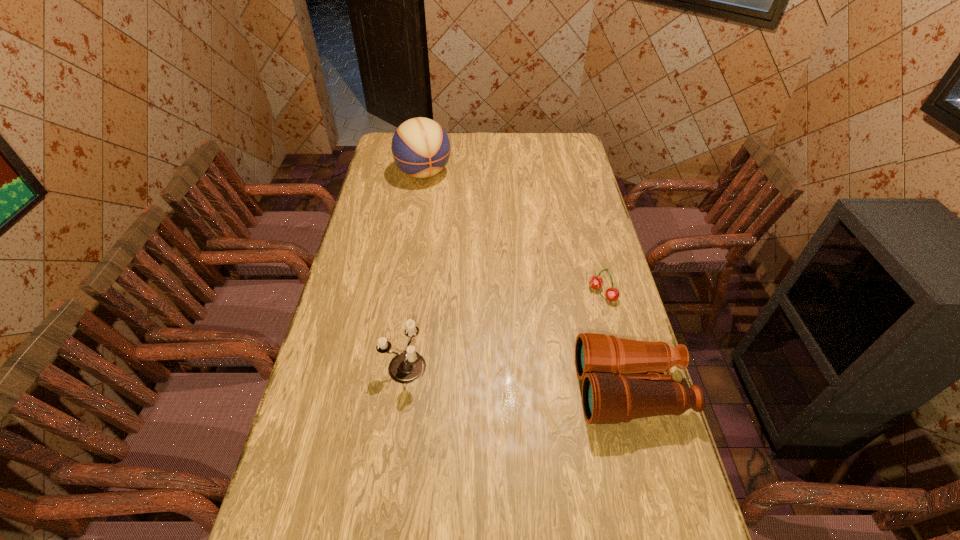
This screenshot has width=960, height=540. In order to click on free space that satisfies the following two spatial constraints: 1. on the front side of the binoculars; 2. through the lenses of the candle holder in this screenshot , I will do `click(401, 390)`.

The image size is (960, 540). What are the coordinates of `blank area in the image that satisfies the following two spatial constraints: 1. on the back side of the candle holder; 2. on the right side of the cherry` in the screenshot? It's located at (415, 293).

The height and width of the screenshot is (540, 960). What are the coordinates of `free point that satisfies the following two spatial constraints: 1. on the front side of the candle holder; 2. through the lenses of the second shortest object` in the screenshot? It's located at (401, 390).

This screenshot has height=540, width=960. Find the location of `vacant space that satisfies the following two spatial constraints: 1. on the front side of the binoculars; 2. through the lenses of the basketball`. vacant space that satisfies the following two spatial constraints: 1. on the front side of the binoculars; 2. through the lenses of the basketball is located at coordinates (390, 390).